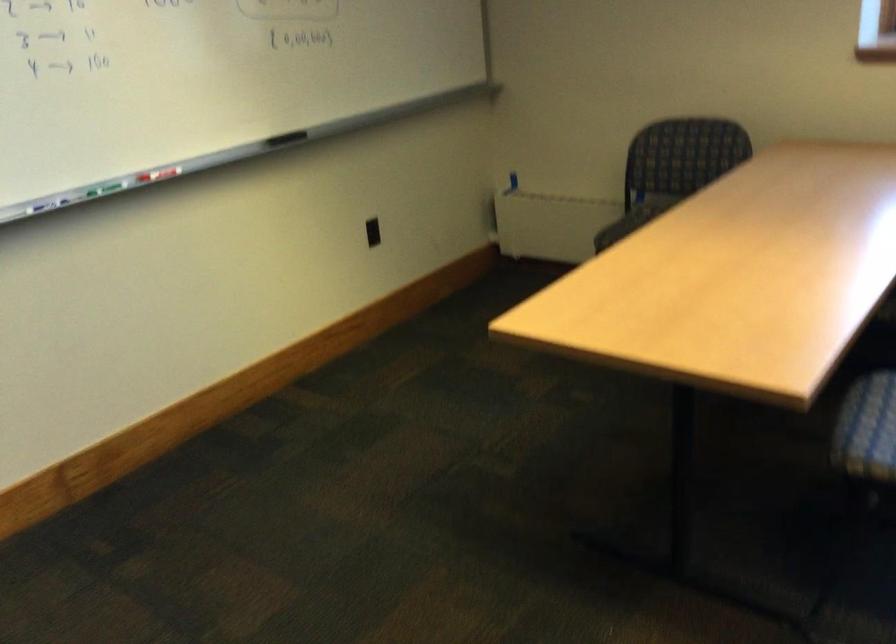
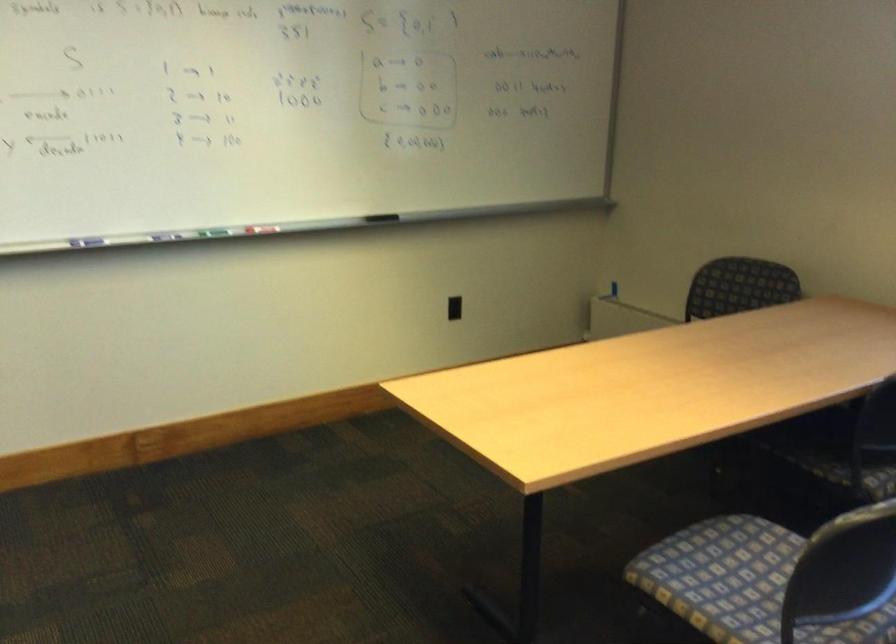
Find the pixel in the second image that matches (285,144) in the first image.

(381, 218)